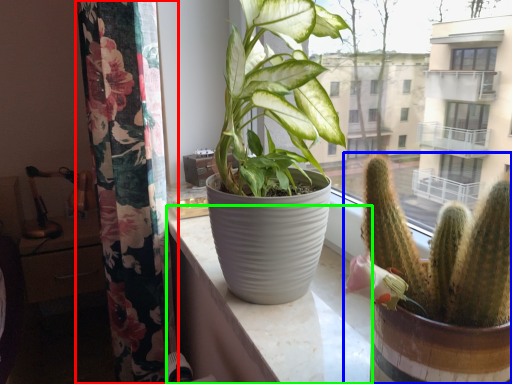
Question: Considering the real-world distances, which object is closest to curtain (highlighted by a red box)? houseplant (highlighted by a blue box) or counter top (highlighted by a green box).

Choices:
 (A) houseplant
 (B) counter top

Answer: (B)